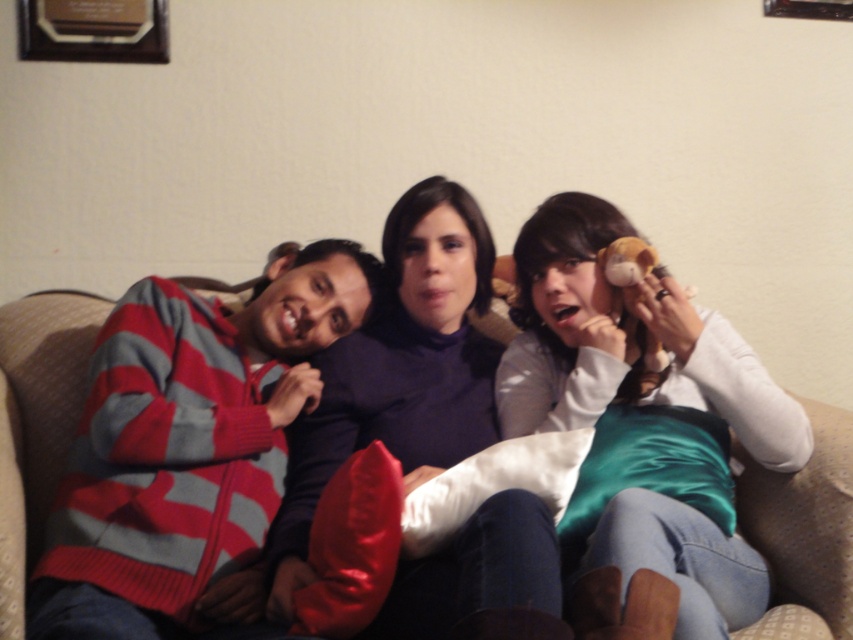
What do you see at coordinates (641, 433) in the screenshot?
I see `white satin pillow at right` at bounding box center [641, 433].

Who is more forward, (604, 509) or (477, 333)?

Point (604, 509) is more forward.

The image size is (853, 640). Identify the location of white satin pillow at right. (641, 433).

Does striped knit sweater at left come behind beige fabric couch at center?

No, striped knit sweater at left is in front of beige fabric couch at center.

Is point (291, 346) behind point (846, 515)?

That is True.

At what (x,y) coordinates should I click in order to perform the action: click on striped knit sweater at left. Please return your answer as a coordinate pair (x, y). Looking at the image, I should click on (189, 451).

Where is `striped knit sweater at left`? This screenshot has width=853, height=640. striped knit sweater at left is located at coordinates (189, 451).

Can you confirm if striped knit sweater at left is thinner than white satin pillow at right?

Yes.

Which of these two, striped knit sweater at left or white satin pillow at right, stands shorter?

striped knit sweater at left is shorter.

Is point (114, 406) farther from camera compared to point (537, 284)?

No, (114, 406) is in front of (537, 284).

Locate an element on the screen. striped knit sweater at left is located at coordinates (189, 451).